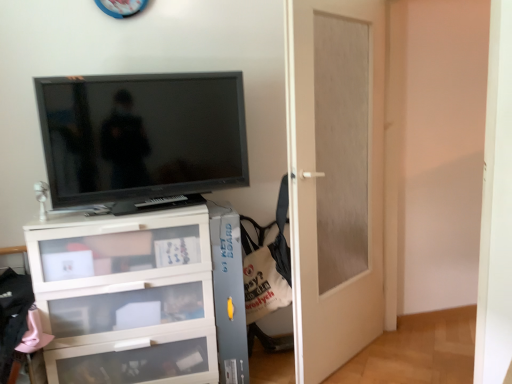
Describe the element at coordinates (335, 178) in the screenshot. This screenshot has width=512, height=384. I see `white matte door at center` at that location.

What is the approximate height of white matte door at center?

white matte door at center is 2.02 meters in height.

Where is `white matte door at center`? The height and width of the screenshot is (384, 512). white matte door at center is located at coordinates 335,178.

You are a GUI agent. You are given a task and a screenshot of the screen. Output one action in this format:
    pyautogui.click(x=<x>, y=<y>)
    Task: Click on the matte black television at upper left
    
    Given the screenshot: What is the action you would take?
    pyautogui.click(x=142, y=135)

What do you see at coordinates (142, 135) in the screenshot?
I see `matte black television at upper left` at bounding box center [142, 135].

Locate an element on the screen. white matte door at center is located at coordinates (335, 178).

Which is more to the right, matte black television at upper left or white matte door at center?

white matte door at center.

Is matte black television at upper left closer to the viewer compared to white matte door at center?

No, matte black television at upper left is behind white matte door at center.

Between point (231, 90) and point (383, 198), which one is positioned in front?

The point (231, 90) is closer.

From the image's perspective, is matte black television at upper left located above white matte door at center?

Yes, from the image's perspective, matte black television at upper left is over white matte door at center.

From a real-world perspective, is matte black television at upper left physically located above or below white matte door at center?

From a real-world perspective, matte black television at upper left is physically above white matte door at center.

Looking at their sizes, would you say matte black television at upper left is wider or thinner than white matte door at center?

matte black television at upper left is thinner than white matte door at center.

Does matte black television at upper left have a greater height compared to white matte door at center?

No.

Can you confirm if matte black television at upper left is smaller than white matte door at center?

Yes.

Looking at this image, which is correct: matte black television at upper left is inside white matte door at center, or outside of it?

matte black television at upper left cannot be found inside white matte door at center.

Is matte black television at upper left beside white matte door at center?

No, matte black television at upper left is not making contact with white matte door at center.

Is matte black television at upper left turned away from white matte door at center?

matte black television at upper left does not have its back to white matte door at center.

Find the location of a particular element. door below the matte black television at upper left (from a real-world perspective) is located at coordinates (335, 178).

Which object is positioned more to the left, white matte door at center or matte black television at upper left?

Positioned to the left is matte black television at upper left.

Which object is closer to the camera, white matte door at center or matte black television at upper left?

white matte door at center is closer to the camera.

Is point (319, 104) positioned behind point (159, 156)?

Yes, it is behind point (159, 156).

From the image's perspective, is white matte door at center on matte black television at upper left?

No, from the image's perspective, white matte door at center is not on top of matte black television at upper left.

From a real-world perspective, between white matte door at center and matte black television at upper left, who is vertically lower?

white matte door at center.

Considering the sizes of objects white matte door at center and matte black television at upper left in the image provided, who is wider, white matte door at center or matte black television at upper left?

white matte door at center is wider.

Does white matte door at center have a lesser height compared to matte black television at upper left?

No, white matte door at center is not shorter than matte black television at upper left.

Who is bigger, white matte door at center or matte black television at upper left?

white matte door at center.

Is white matte door at center inside or outside of matte black television at upper left?

The correct answer is: outside.

Is there a large distance between white matte door at center and matte black television at upper left?

No, white matte door at center is not far from matte black television at upper left.

Does white matte door at center turn towards matte black television at upper left?

No, white matte door at center does not turn towards matte black television at upper left.

The height and width of the screenshot is (384, 512). Find the location of `door located on the right of matte black television at upper left`. door located on the right of matte black television at upper left is located at coordinates (335, 178).

This screenshot has height=384, width=512. Identify the location of television on the left side of white matte door at center. (142, 135).

In order to click on door below the matte black television at upper left (from a real-world perspective) in this screenshot , I will do `click(335, 178)`.